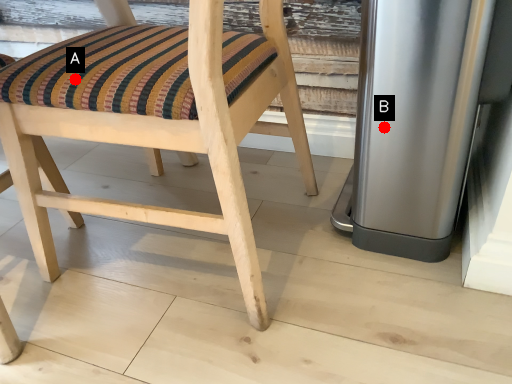
Question: Two points are circled on the image, labeled by A and B beside each circle. Which point is closer to the camera?

Choices:
 (A) A is closer
 (B) B is closer

Answer: (A)